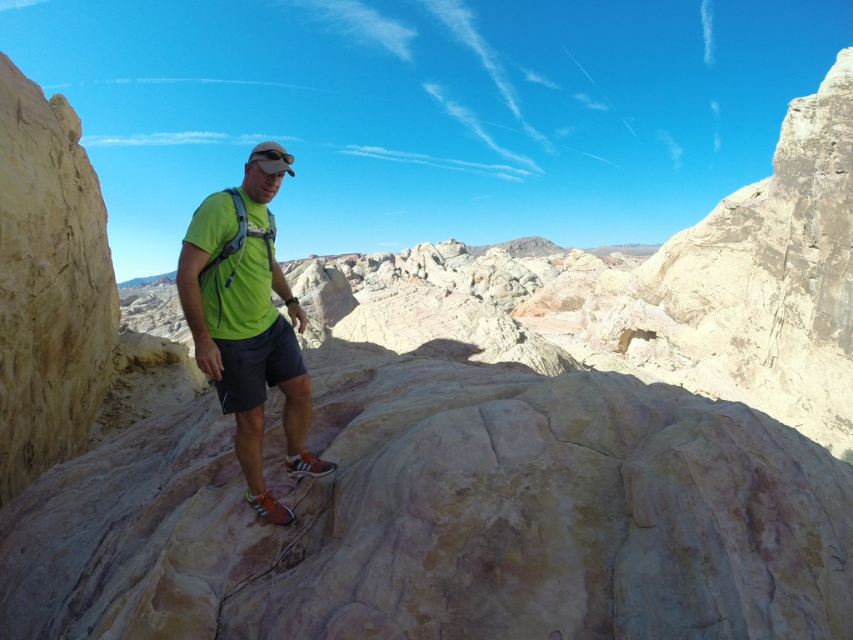
Between green matte shirt at center and black cotton shorts at center, which one is positioned higher?

green matte shirt at center

Does green matte shirt at center appear on the left side of black cotton shorts at center?

Indeed, green matte shirt at center is positioned on the left side of black cotton shorts at center.

Between point (310, 403) and point (247, 362), which one is positioned behind?

Point (310, 403)

Find the location of `green matte shirt at center`. green matte shirt at center is located at coordinates (248, 321).